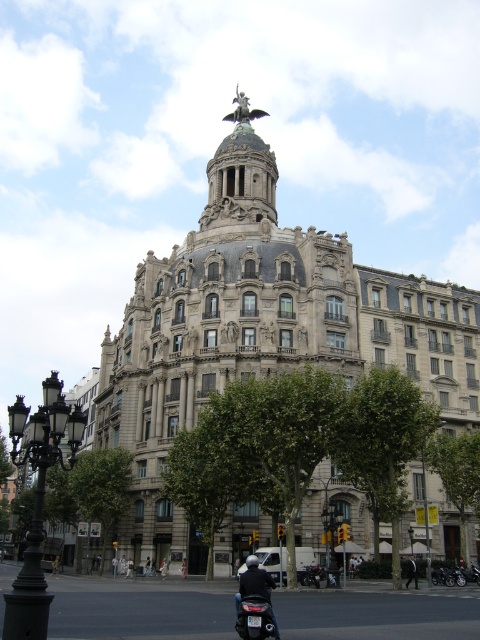
Question: Does green leafy tree at lower left have a larger size compared to matte black scooter at lower center?

Choices:
 (A) yes
 (B) no

Answer: (A)

Question: From the image, what is the correct spatial relationship of green leafy tree at lower left in relation to matte black scooter at lower center?

Choices:
 (A) right
 (B) left

Answer: (B)

Question: Which point is farther to the camera?

Choices:
 (A) (248, 605)
 (B) (32, 625)

Answer: (A)

Question: In this image, where is green leafy tree at lower right located relative to matte black scooter at lower center?

Choices:
 (A) above
 (B) below

Answer: (B)

Question: Considering the real-world distances, which object is closest to the green leafy tree at lower left?

Choices:
 (A) green leafy tree at lower right
 (B) matte black scooter at lower center
 (C) green leafy tree at center
 (D) black wrought iron streetlight at lower left

Answer: (D)

Question: Which point is closer to the camera taking this photo?

Choices:
 (A) (247, 636)
 (B) (122, 492)

Answer: (A)